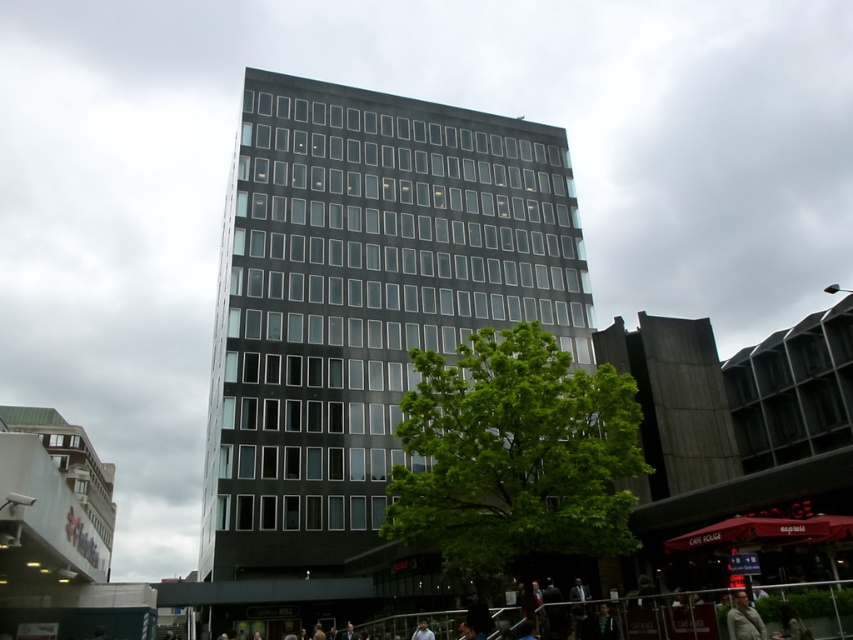
You are a photographer standing at the edge of the pedestrian area. You want to capture a photo that includes both the black glass building at center and the green fabric jacket at lower right. Considering their sizes, which object should you frame first to ensure both fit in the shot?

The black glass building at center is wider than the green fabric jacket at lower right. To ensure both fit in the shot, frame the black glass building at center first as it takes up more space, then adjust the camera angle to include the green fabric jacket at lower right.

You are standing at the base of the tall building and looking towards the tree. You see two points marked in the scene. Which point is closer to you, point (223, 460) or point (747, 616)?

Point (223, 460) is closer to you because it is further to the viewer than point (747, 616).

You are a pedestrian standing on the sidewalk and see the black glass building at center and the green fabric jacket at lower right. Which object is closer to you?

The green fabric jacket at lower right is behind the black glass building at center, so the black glass building at center is closer to you.